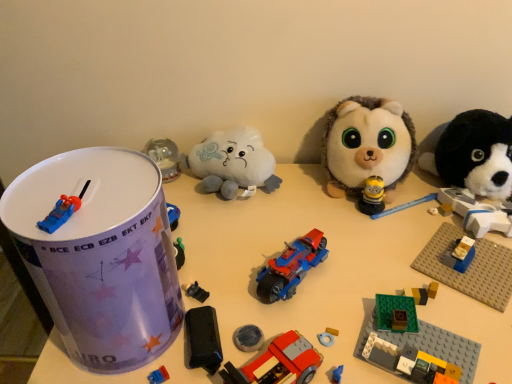
At what (x,y) coordinates should I click in order to perform the action: click on vacant space behind green plastic building block at lower right, the third toy from the right. Please return your answer as a coordinate pair (x, y). Image resolution: width=512 pixels, height=384 pixels. Looking at the image, I should click on (378, 251).